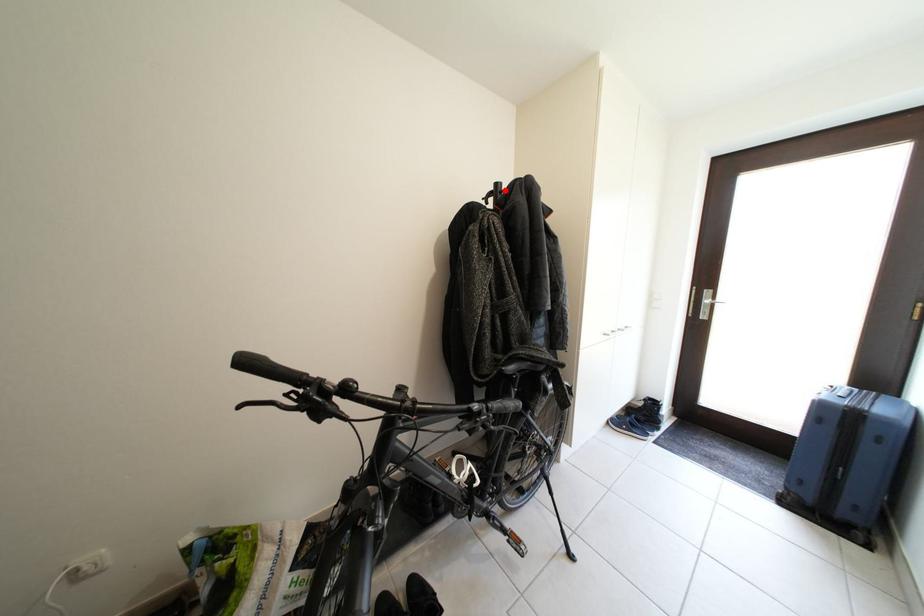
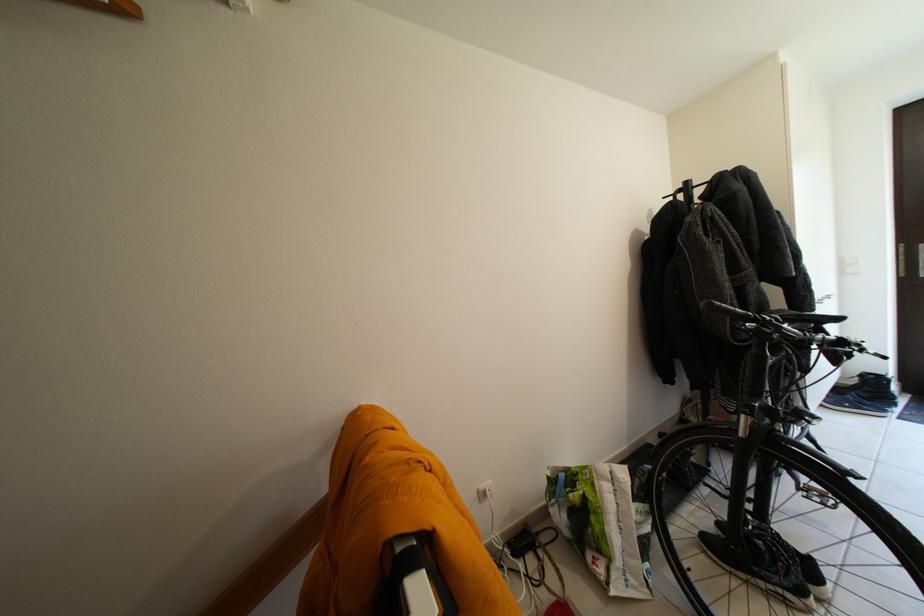
Find the pixel in the second image that matches the highlighted location in the first image.

(696, 188)